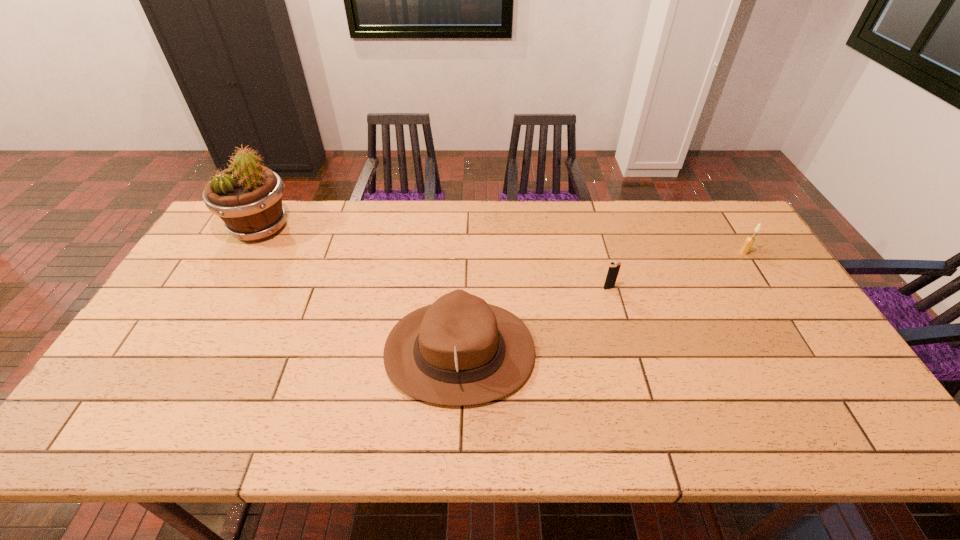
Where is `free space that is in between the second tallest object and the third farthest object`? Image resolution: width=960 pixels, height=540 pixels. free space that is in between the second tallest object and the third farthest object is located at coordinates (534, 320).

At what (x,y) coordinates should I click in order to perform the action: click on object that is the nearest to the candle. Please return your answer as a coordinate pair (x, y). The image size is (960, 540). Looking at the image, I should click on (614, 267).

The width and height of the screenshot is (960, 540). In order to click on object that is the second closest to the flowerpot in this screenshot , I will do `click(614, 267)`.

At what (x,y) coordinates should I click in order to perform the action: click on free space that satisfies the following two spatial constraints: 1. on the front side of the rightmost object; 2. on the feather side of the second object from left to right. Please return your answer as a coordinate pair (x, y). Image resolution: width=960 pixels, height=540 pixels. Looking at the image, I should click on (806, 352).

Where is `vacant space that satisfies the following two spatial constraints: 1. on the front side of the rightmost object; 2. on the feather side of the fedora`? vacant space that satisfies the following two spatial constraints: 1. on the front side of the rightmost object; 2. on the feather side of the fedora is located at coordinates (806, 352).

The height and width of the screenshot is (540, 960). Identify the location of vacant space that satisfies the following two spatial constraints: 1. on the front side of the second nearest object; 2. on the feather side of the second object from left to right. click(627, 352).